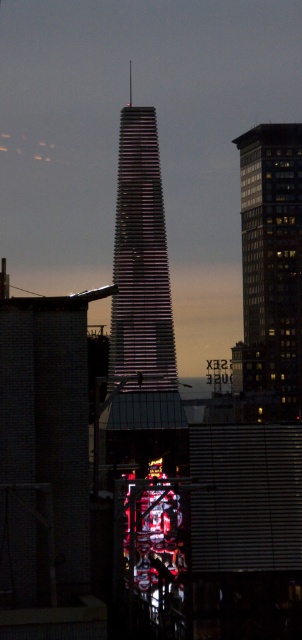
From the picture: You are standing in the city square and want to take a photo of both the glassy reflective skyscraper at right and the shiny glass tower at center. Which building should you position yourself closer to in order to capture both in the same frame?

To capture both the glassy reflective skyscraper at right and the shiny glass tower at center in the same frame, you should position yourself closer to the shiny glass tower at center. Since the glassy reflective skyscraper at right is located to the right of the shiny glass tower at center, moving closer to the central tower will help include both structures within your camera view.

You are standing in the city park and looking at the glassy reflective skyscraper at right and the shiny glass tower at center. Which building appears taller from your viewpoint?

The shiny glass tower at center appears taller than the glassy reflective skyscraper at right because it is taller in reality.

You are a city planner reviewing this urban layout. You need to determine the spatial relationship between the glassy reflective skyscraper at right and the shiny glass tower at center. Which one is positioned further away from the viewer?

The shiny glass tower at center is positioned further away from the viewer because it is described as being behind the glassy reflective skyscraper at right.